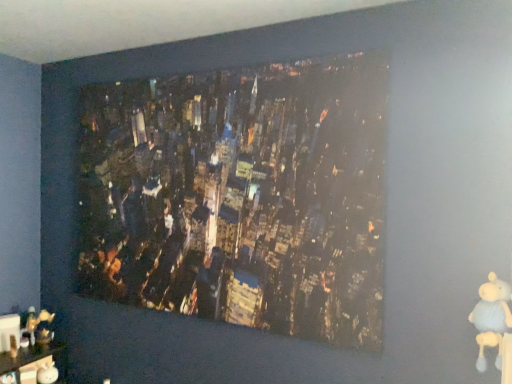
Question: Is matte cityscape print at center positioned behind white plush bear at lower right?

Choices:
 (A) yes
 (B) no

Answer: (A)

Question: Considering the relative positions of matte cityscape print at center and white plush bear at lower right in the image provided, is matte cityscape print at center to the right of white plush bear at lower right from the viewer's perspective?

Choices:
 (A) no
 (B) yes

Answer: (A)

Question: Considering the relative sizes of matte cityscape print at center and white plush bear at lower right in the image provided, is matte cityscape print at center taller than white plush bear at lower right?

Choices:
 (A) no
 (B) yes

Answer: (B)

Question: From a real-world perspective, is matte cityscape print at center positioned over white plush bear at lower right based on gravity?

Choices:
 (A) yes
 (B) no

Answer: (A)

Question: Is white plush bear at lower right completely or partially inside matte cityscape print at center?

Choices:
 (A) yes
 (B) no

Answer: (B)

Question: Is white plush bear at lower right wider or thinner than matte cityscape print at center?

Choices:
 (A) wide
 (B) thin

Answer: (A)

Question: From the image's perspective, is white plush bear at lower right above or below matte cityscape print at center?

Choices:
 (A) above
 (B) below

Answer: (B)

Question: Visually, is white plush bear at lower right positioned to the left or to the right of matte cityscape print at center?

Choices:
 (A) left
 (B) right

Answer: (B)

Question: Considering the positions of point (500, 349) and point (343, 61), is point (500, 349) closer or farther from the camera than point (343, 61)?

Choices:
 (A) farther
 (B) closer

Answer: (B)

Question: Is point (507, 289) positioned closer to the camera than point (30, 347)?

Choices:
 (A) closer
 (B) farther

Answer: (A)

Question: From a real-world perspective, is white plush bear at lower right physically located above or below wooden figurine at lower left?

Choices:
 (A) above
 (B) below

Answer: (A)

Question: Based on their positions, is white plush bear at lower right located to the left or right of wooden figurine at lower left?

Choices:
 (A) left
 (B) right

Answer: (B)

Question: From the image's perspective, is white plush bear at lower right positioned above or below wooden figurine at lower left?

Choices:
 (A) above
 (B) below

Answer: (A)

Question: Looking at their shapes, would you say wooden figurine at lower left is wider or thinner than matte cityscape print at center?

Choices:
 (A) wide
 (B) thin

Answer: (A)

Question: In the image, is wooden figurine at lower left positioned in front of or behind matte cityscape print at center?

Choices:
 (A) behind
 (B) front

Answer: (A)